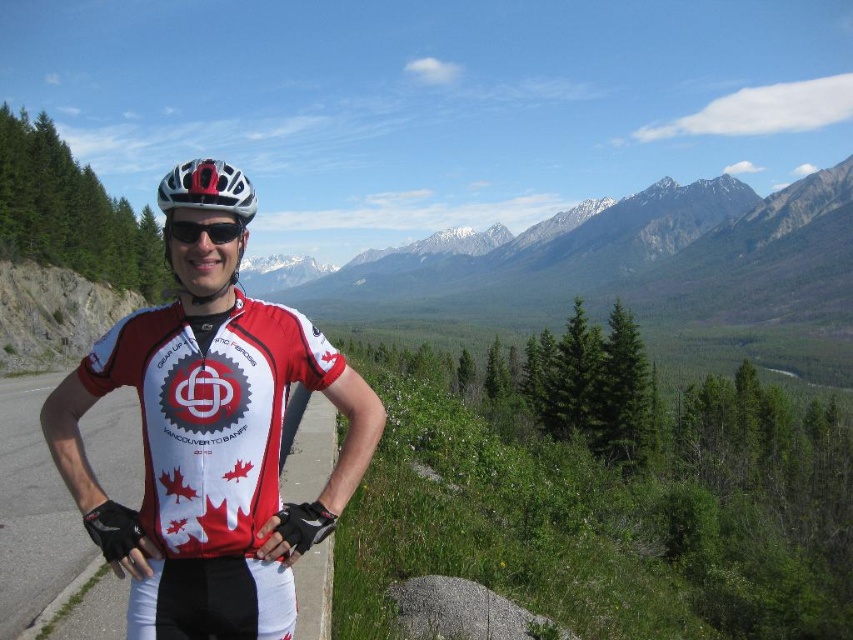
In the scene shown: You are a photographer planning to take a portrait of the cyclist. You want to ensure that both the white matte cycling jersey at center and the white matte helmet at center are clearly visible. Based on their positions, which one should you focus on first to ensure proper framing?

The white matte cycling jersey at center is located below the white matte helmet at center. To ensure proper framing, focus on the white matte helmet at center first since it is higher up and will be the first point of interest, then adjust to include the jersey below it.

Looking at this image, you are a photographer trying to capture the cyclist in the image. You want to ensure that both the white matte cycling jersey at center and the white matte bicycle helmet at center are clearly visible in your shot. Which object should you focus on first to ensure both are in focus?

The white matte cycling jersey at center is positioned under the white matte bicycle helmet at center. To ensure both are in focus, you should focus on the white matte bicycle helmet at center first since it is closer to the camera, and the jersey below it will naturally fall into the depth of field.

You are a photographer planning to take a portrait of the cyclist. You need to decide whether to adjust the camera focus to accommodate both the white matte bicycle helmet at center and the black matte sunglasses at center in the same shot. Considering their sizes, which object would require more focus adjustment due to its size?

The white matte bicycle helmet at center has a larger size compared to black matte sunglasses at center, so it would require more focus adjustment due to its larger size.